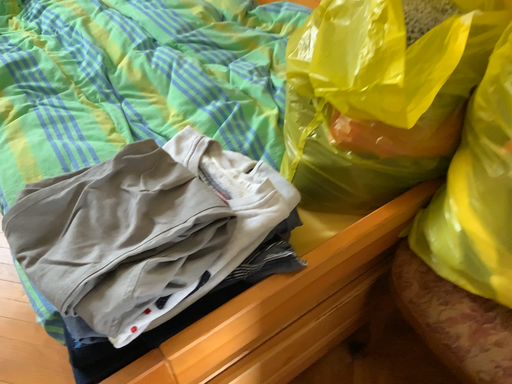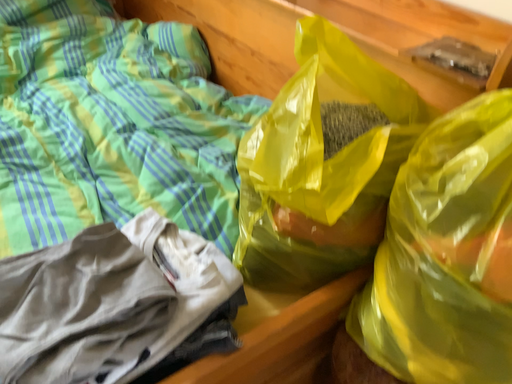
Question: How did the camera likely rotate when shooting the video?

Choices:
 (A) rotated upward
 (B) rotated downward

Answer: (A)